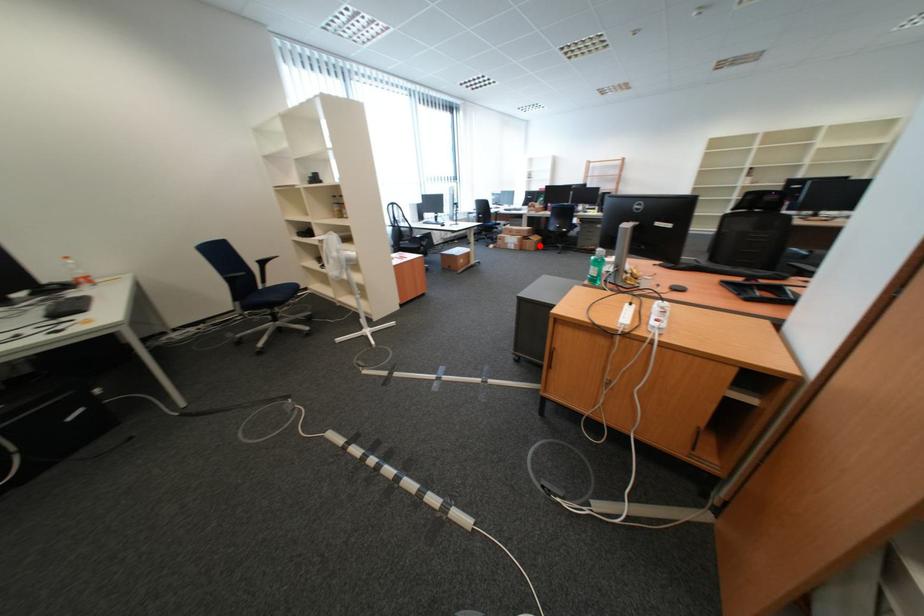
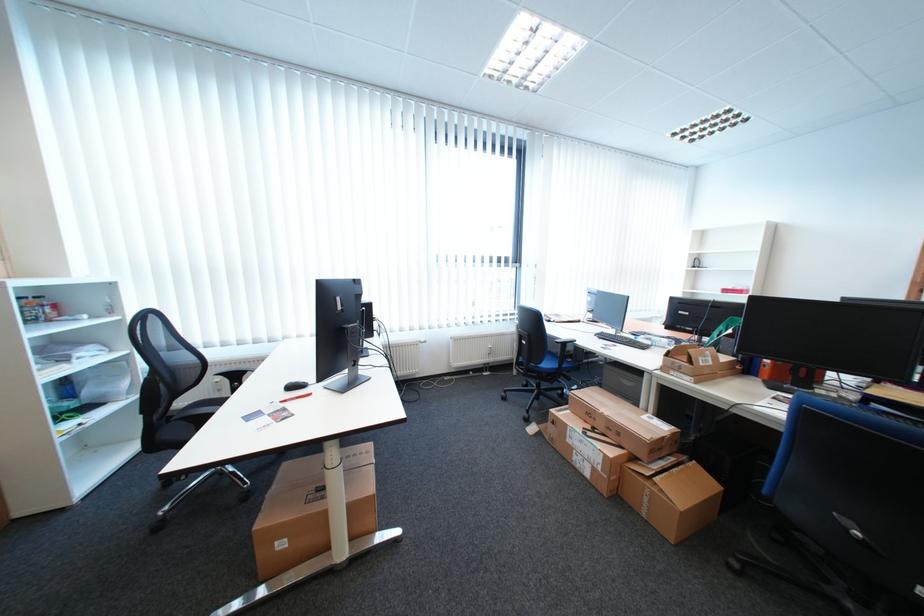
Question: I am providing you with two images of the same scene from different viewpoints. Given a red point in image1, look at the same physical point in image2. Is it:

Choices:
 (A) Closer to the viewpoint
 (B) Farther from the viewpoint

Answer: (B)